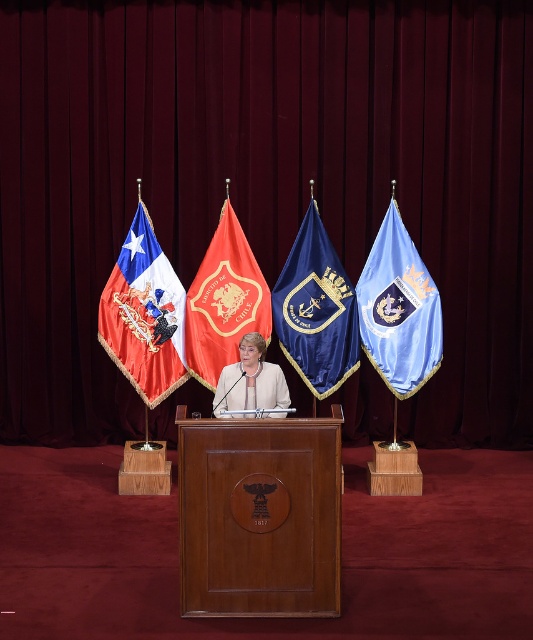
What is located at the point with coordinates [260,515] in the image?

The wooden podium at center is located at point [260,515].

You are an event organizer who needs to ensure the wooden podium at center and the red fabric flag at center are positioned correctly. Based on the scene description, which object is closer to the audience? Please explain your reasoning.

The wooden podium at center is closer to the viewer than the red fabric flag at center, so the podium is positioned closer to the audience.